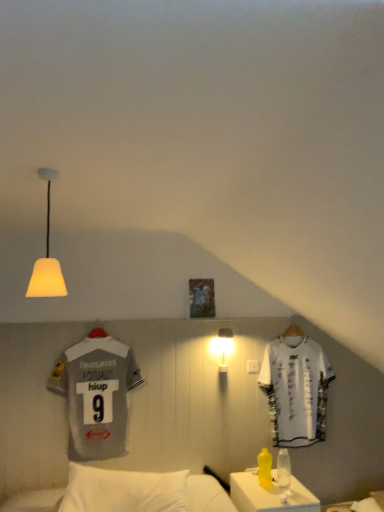
The image size is (384, 512). Find the location of `white frosted glass wall lamp at center, marked as the 1th lamp in a right-to-left arrangement`. white frosted glass wall lamp at center, marked as the 1th lamp in a right-to-left arrangement is located at coordinates (222, 347).

The image size is (384, 512). What do you see at coordinates (97, 395) in the screenshot? I see `gray jersey at left, which appears as the second sports uniform when viewed from the right` at bounding box center [97, 395].

Where is `yellow translucent bottle at lower right, the 1th bottle viewed from the right`? This screenshot has width=384, height=512. yellow translucent bottle at lower right, the 1th bottle viewed from the right is located at coordinates (283, 468).

The width and height of the screenshot is (384, 512). Identify the location of white matte lampshade at upper left, which appears as the second lamp when viewed from the back. (47, 256).

Where is `white matte sports uniform at right, which is the first sports uniform from back to front`? This screenshot has height=512, width=384. white matte sports uniform at right, which is the first sports uniform from back to front is located at coordinates (296, 388).

From the image's perspective, which is below, white matte lampshade at upper left, which is counted as the 1th lamp, starting from the front, or white matte sports uniform at right, acting as the first sports uniform starting from the right?

white matte sports uniform at right, acting as the first sports uniform starting from the right, is shown below in the image.

I want to click on the 2nd lamp directly above the white matte sports uniform at right, acting as the first sports uniform starting from the right (from a real-world perspective), so click(47, 256).

Is white matte lampshade at upper left, which appears as the second lamp when viewed from the back, next to white matte sports uniform at right, acting as the first sports uniform starting from the right, and touching it?

There is a gap between white matte lampshade at upper left, which appears as the second lamp when viewed from the back, and white matte sports uniform at right, acting as the first sports uniform starting from the right.

Is white matte sports uniform at right, the 2th sports uniform positioned from the left, at the back of white matte lampshade at upper left, which appears as the second lamp when viewed from the back?

No, white matte sports uniform at right, the 2th sports uniform positioned from the left, is not at the back of white matte lampshade at upper left, which appears as the second lamp when viewed from the back.

Consider the image. From the image's perspective, is gray jersey at left, the first sports uniform viewed from the left, above or below white matte lampshade at upper left, arranged as the second lamp when ordered from the bottom?

gray jersey at left, the first sports uniform viewed from the left, is below white matte lampshade at upper left, arranged as the second lamp when ordered from the bottom.

Is gray jersey at left, which is the 2th sports uniform from back to front, with white matte lampshade at upper left, which is the 1th lamp from left to right?

gray jersey at left, which is the 2th sports uniform from back to front, is not next to white matte lampshade at upper left, which is the 1th lamp from left to right, and they're not touching.

Based on their sizes in the image, would you say gray jersey at left, which appears as the second sports uniform when viewed from the right, is bigger or smaller than white matte lampshade at upper left, the first lamp viewed from the top?

Considering their sizes, gray jersey at left, which appears as the second sports uniform when viewed from the right, takes up more space than white matte lampshade at upper left, the first lamp viewed from the top.

From the image's perspective, does white plastic table at lower right appear higher than gray jersey at left, marked as the first sports uniform in a front-to-back arrangement?

No, from the image's perspective, white plastic table at lower right is not above gray jersey at left, marked as the first sports uniform in a front-to-back arrangement.

Is white plastic table at lower right next to gray jersey at left, the first sports uniform viewed from the left, and touching it?

There is a gap between white plastic table at lower right and gray jersey at left, the first sports uniform viewed from the left.

In the scene shown: From a real-world perspective, is white plastic table at lower right on gray jersey at left, which is the 2th sports uniform from back to front?

No, from a real-world perspective, white plastic table at lower right is not above gray jersey at left, which is the 2th sports uniform from back to front.

From the image's perspective, relative to yellow translucent bottle at lower right, the 1th bottle viewed from the right, is yellow matte bottle at lower right, acting as the second bottle starting from the right, above or below?

yellow matte bottle at lower right, acting as the second bottle starting from the right, is below yellow translucent bottle at lower right, the 1th bottle viewed from the right.

Is point (263, 454) farther from camera compared to point (278, 481)?

Yes, it is behind point (278, 481).

Looking at the image, does yellow matte bottle at lower right, acting as the second bottle starting from the right, seem bigger or smaller compared to yellow translucent bottle at lower right, the 1th bottle viewed from the right?

Considering their sizes, yellow matte bottle at lower right, acting as the second bottle starting from the right, takes up more space than yellow translucent bottle at lower right, the 1th bottle viewed from the right.

Who is taller, yellow matte bottle at lower right, acting as the second bottle starting from the right, or yellow translucent bottle at lower right, the 1th bottle viewed from the right?

With more height is yellow translucent bottle at lower right, the 1th bottle viewed from the right.

This screenshot has height=512, width=384. What are the coordinates of `table in front of the yellow matte bottle at lower right, acting as the second bottle starting from the right` in the screenshot? It's located at pyautogui.click(x=269, y=495).

Consider the image. Does yellow matte bottle at lower right, which is counted as the 1th bottle, starting from the left, appear on the left side of white plastic table at lower right?

Correct, you'll find yellow matte bottle at lower right, which is counted as the 1th bottle, starting from the left, to the left of white plastic table at lower right.

Which is further, (270, 471) or (263, 493)?

Positioned behind is point (270, 471).

Who is more distant, white matte lampshade at upper left, the first lamp viewed from the top, or white plastic table at lower right?

white plastic table at lower right is more distant.

Is point (47, 246) closer or farther from the camera than point (243, 509)?

Point (47, 246) appears to be closer to the viewer than point (243, 509).

Would you say white matte lampshade at upper left, arranged as the second lamp when ordered from the bottom, is a long distance from yellow translucent bottle at lower right, the second bottle positioned from the left?

Yes, white matte lampshade at upper left, arranged as the second lamp when ordered from the bottom, and yellow translucent bottle at lower right, the second bottle positioned from the left, are located far from each other.

Can you confirm if white matte lampshade at upper left, arranged as the second lamp when ordered from the bottom, is thinner than yellow translucent bottle at lower right, the second bottle positioned from the left?

In fact, white matte lampshade at upper left, arranged as the second lamp when ordered from the bottom, might be wider than yellow translucent bottle at lower right, the second bottle positioned from the left.

You are a GUI agent. You are given a task and a screenshot of the screen. Output one action in this format:
    pyautogui.click(x=<x>, y=<y>)
    Task: Click on the 2nd lamp counting from the left side of the yellow translucent bottle at lower right, the 1th bottle viewed from the right
    Image resolution: width=384 pixels, height=512 pixels.
    Given the screenshot: What is the action you would take?
    pyautogui.click(x=47, y=256)

At what (x,y) coordinates should I click in order to perform the action: click on the 2nd lamp in front of the white matte sports uniform at right, which is the first sports uniform from back to front, starting your count from the anchor. Please return your answer as a coordinate pair (x, y). The height and width of the screenshot is (512, 384). Looking at the image, I should click on (47, 256).

Starting from the gray jersey at left, which is the 2th sports uniform from back to front, which lamp is the 1st one to the right? Please provide its 2D coordinates.

[(47, 256)]

Considering their positions, is yellow matte bottle at lower right, which is counted as the 1th bottle, starting from the left, positioned closer to white frosted glass wall lamp at center, the 2th lamp from the left, than white matte sports uniform at right, acting as the first sports uniform starting from the right?

white matte sports uniform at right, acting as the first sports uniform starting from the right, is closer to white frosted glass wall lamp at center, the 2th lamp from the left.

From the image, which object appears to be farther from gray jersey at left, marked as the first sports uniform in a front-to-back arrangement, white plastic table at lower right or white matte lampshade at upper left, the first lamp viewed from the top?

Among the two, white matte lampshade at upper left, the first lamp viewed from the top, is located further to gray jersey at left, marked as the first sports uniform in a front-to-back arrangement.

Considering their positions, is white matte lampshade at upper left, arranged as the second lamp when ordered from the bottom, positioned further to white frosted glass wall lamp at center, which is the 2th lamp in top-to-bottom order, than white plastic table at lower right?

white matte lampshade at upper left, arranged as the second lamp when ordered from the bottom, is further to white frosted glass wall lamp at center, which is the 2th lamp in top-to-bottom order.

Considering their positions, is yellow matte bottle at lower right, which is counted as the 1th bottle, starting from the left, positioned further to gray jersey at left, marked as the first sports uniform in a front-to-back arrangement, than white matte sports uniform at right, the 2th sports uniform positioned from the left?

white matte sports uniform at right, the 2th sports uniform positioned from the left.

Estimate the real-world distances between objects in this image. Which object is further from white plastic table at lower right, white frosted glass wall lamp at center, marked as the 1th lamp in a right-to-left arrangement, or yellow matte bottle at lower right, acting as the second bottle starting from the right?

white frosted glass wall lamp at center, marked as the 1th lamp in a right-to-left arrangement, is positioned further to the anchor white plastic table at lower right.

Considering their positions, is white matte sports uniform at right, the 2th sports uniform positioned from the left, positioned further to white frosted glass wall lamp at center, marked as the 1th lamp in a right-to-left arrangement, than yellow translucent bottle at lower right, the 1th bottle viewed from the right?

The object further to white frosted glass wall lamp at center, marked as the 1th lamp in a right-to-left arrangement, is yellow translucent bottle at lower right, the 1th bottle viewed from the right.

Based on their spatial positions, is yellow matte bottle at lower right, acting as the second bottle starting from the right, or yellow translucent bottle at lower right, the 1th bottle viewed from the right, closer to white frosted glass wall lamp at center, the 1th lamp when ordered from bottom to top?

Based on the image, yellow matte bottle at lower right, acting as the second bottle starting from the right, appears to be nearer to white frosted glass wall lamp at center, the 1th lamp when ordered from bottom to top.

Looking at the image, which one is located closer to white frosted glass wall lamp at center, the 1th lamp when ordered from bottom to top, yellow matte bottle at lower right, which is counted as the 1th bottle, starting from the left, or gray jersey at left, which is the 2th sports uniform from back to front?

yellow matte bottle at lower right, which is counted as the 1th bottle, starting from the left, lies closer to white frosted glass wall lamp at center, the 1th lamp when ordered from bottom to top, than the other object.

Identify the location of lamp between white matte lampshade at upper left, which is counted as the 1th lamp, starting from the front, and white matte sports uniform at right, the 2th sports uniform positioned from the left, from front to back. Image resolution: width=384 pixels, height=512 pixels. (x=222, y=347).

Where is `bottle that lies between white frosted glass wall lamp at center, which is the 2th lamp in top-to-bottom order, and yellow matte bottle at lower right, which is counted as the 1th bottle, starting from the left, from top to bottom`? Image resolution: width=384 pixels, height=512 pixels. bottle that lies between white frosted glass wall lamp at center, which is the 2th lamp in top-to-bottom order, and yellow matte bottle at lower right, which is counted as the 1th bottle, starting from the left, from top to bottom is located at coordinates (283, 468).

Where is `table located between gray jersey at left, which is the 2th sports uniform from back to front, and white matte sports uniform at right, acting as the first sports uniform starting from the right, in the left-right direction`? The image size is (384, 512). table located between gray jersey at left, which is the 2th sports uniform from back to front, and white matte sports uniform at right, acting as the first sports uniform starting from the right, in the left-right direction is located at coordinates (269, 495).

The height and width of the screenshot is (512, 384). I want to click on bottle between gray jersey at left, the first sports uniform viewed from the left, and yellow translucent bottle at lower right, the 1th bottle viewed from the right, from left to right, so click(264, 468).